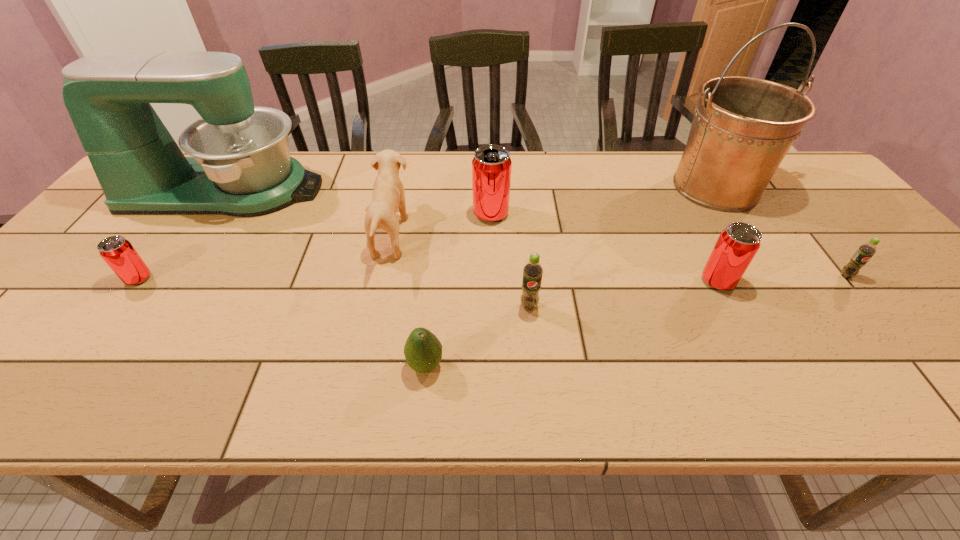
In order to click on vacant space located 0.080m on the front label of the fourth object from right to left in this screenshot , I will do `click(533, 343)`.

Identify the location of blank area located on the back of the second soda from right to left. (685, 217).

This screenshot has height=540, width=960. I want to click on vacant region located on the right of the leftmost red soda can, so click(x=316, y=279).

The image size is (960, 540). I want to click on vacant space positioned 0.220m on the front label of the rightmost soda, so click(914, 360).

Locate an element on the screen. The height and width of the screenshot is (540, 960). free space located on the right of the nearest object is located at coordinates (594, 365).

You are a GUI agent. You are given a task and a screenshot of the screen. Output one action in this format:
    pyautogui.click(x=<x>, y=<y>)
    Task: Click on the bucket present at the far edge
    
    Given the screenshot: What is the action you would take?
    pyautogui.click(x=743, y=127)

I want to click on mixer present at the far edge, so click(240, 166).

Find the location of a particular element. The width and height of the screenshot is (960, 540). object that is positioned at the near edge is located at coordinates (423, 351).

Where is `object that is at the left edge`? object that is at the left edge is located at coordinates (240, 166).

This screenshot has height=540, width=960. In order to click on object that is at the right edge in this screenshot , I will do `click(866, 251)`.